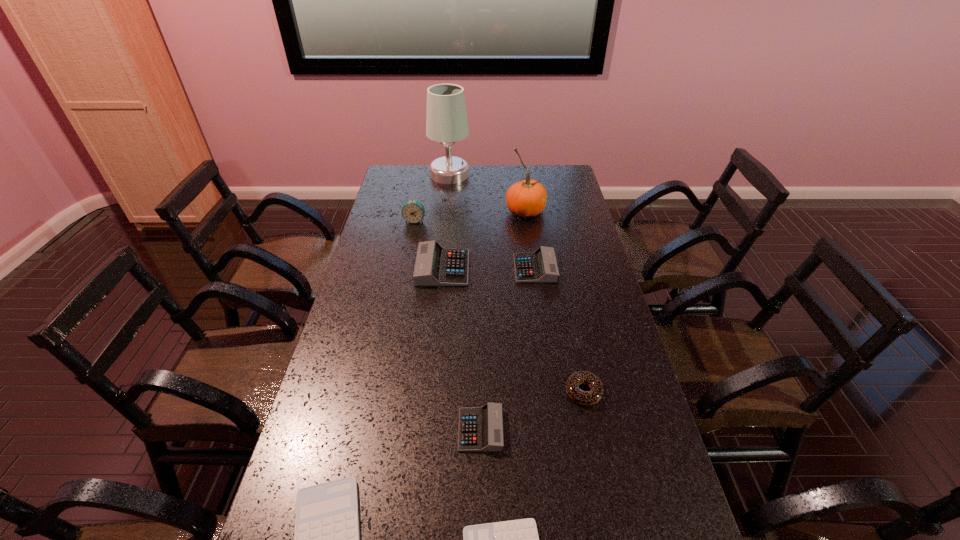
Identify the location of lampshade. (446, 119).

Find the location of a particular element. The height and width of the screenshot is (540, 960). the tallest object is located at coordinates (446, 119).

This screenshot has width=960, height=540. I want to click on the second tallest object, so click(x=527, y=198).

The width and height of the screenshot is (960, 540). Identify the location of orange pumpkin. (527, 198).

Identify the location of alarm clock. (413, 211).

Identify the location of blue alarm clock. (413, 211).

Find the location of a particular element. This screenshot has height=540, width=960. the biggest gray calculator is located at coordinates (435, 266).

What are the coordinates of `the fourth tallest object` in the screenshot? It's located at [435, 266].

Where is `the fourth shortest calculator`? Image resolution: width=960 pixels, height=540 pixels. the fourth shortest calculator is located at coordinates (540, 266).

This screenshot has width=960, height=540. What are the coordinates of `the rightmost gray calculator` in the screenshot? It's located at (540, 266).